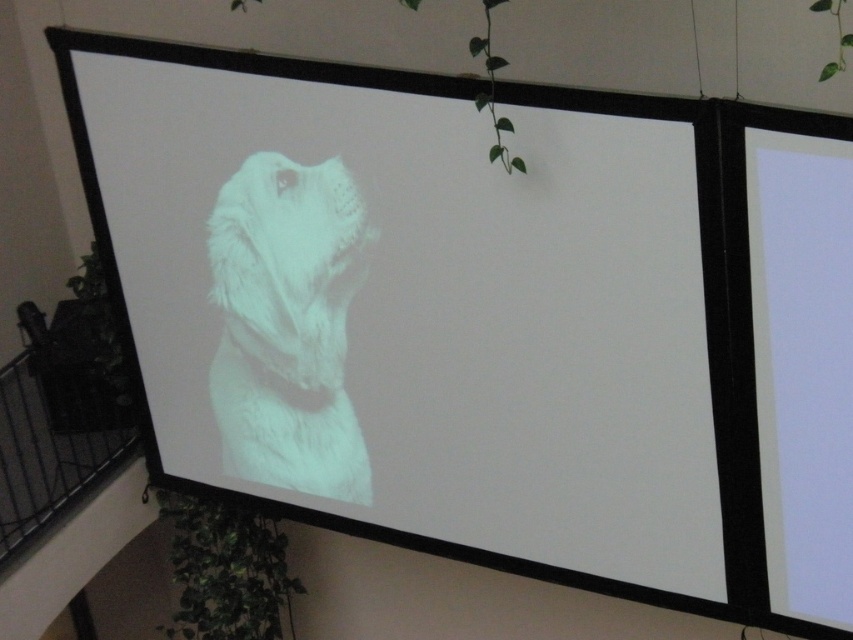
Who is taller, white matte dog at center or white fur dog at center?

Standing taller between the two is white matte dog at center.

Is white matte dog at center above white fur dog at center?

No.

At what (x,y) coordinates should I click in order to perform the action: click on white matte dog at center. Please return your answer as a coordinate pair (x, y). Image resolution: width=853 pixels, height=640 pixels. Looking at the image, I should click on (416, 307).